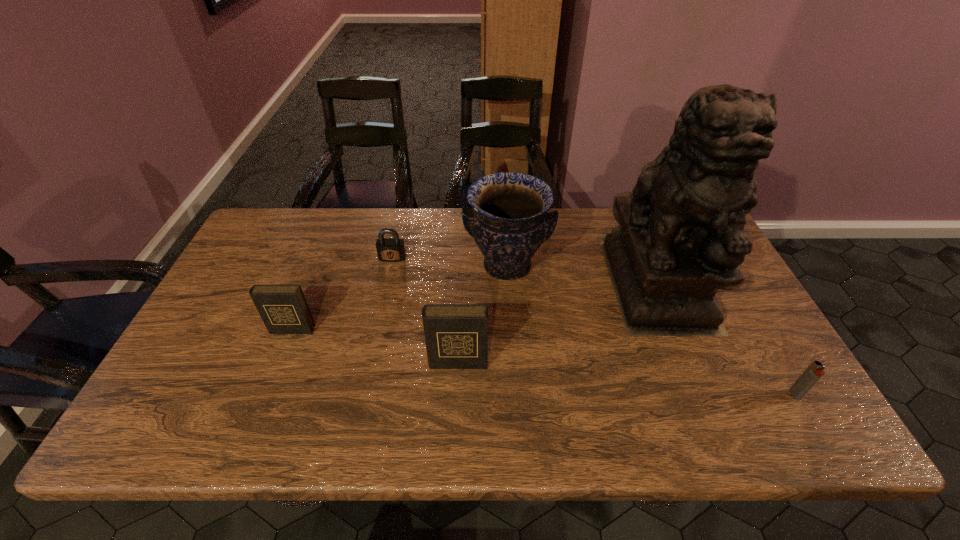
Where is `the leftmost object`? This screenshot has height=540, width=960. the leftmost object is located at coordinates (283, 308).

Identify the location of the fourth tallest object. The image size is (960, 540). coord(283,308).

You are a GUI agent. You are given a task and a screenshot of the screen. Output one action in this format:
    pyautogui.click(x=<x>, y=<y>)
    Task: Click on the taller diary
    The width and height of the screenshot is (960, 540).
    Given the screenshot: What is the action you would take?
    pyautogui.click(x=456, y=335)

The height and width of the screenshot is (540, 960). Identify the location of the third tallest object. (456, 335).

Identify the location of the tallest object. coord(680,237).

Identify the location of sculpture. The width and height of the screenshot is (960, 540). (680, 237).

The image size is (960, 540). Find the location of `padlock`. padlock is located at coordinates (388, 249).

Locate an element on the screen. The width and height of the screenshot is (960, 540). pottery is located at coordinates (509, 221).

You are a GUI agent. You are given a task and a screenshot of the screen. Output one action in this format:
    pyautogui.click(x=<x>, y=<y>)
    Task: Click on the rightmost object
    The width and height of the screenshot is (960, 540).
    Given the screenshot: What is the action you would take?
    pyautogui.click(x=814, y=372)

I want to click on the nearest object, so [814, 372].